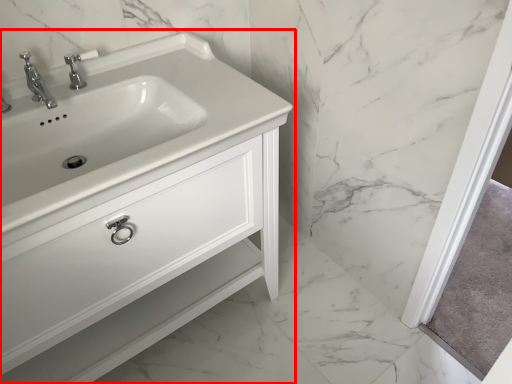
Question: Observing the image, what is the correct spatial positioning of bathroom cabinet (annotated by the red box) in reference to tap?

Choices:
 (A) right
 (B) left

Answer: (A)